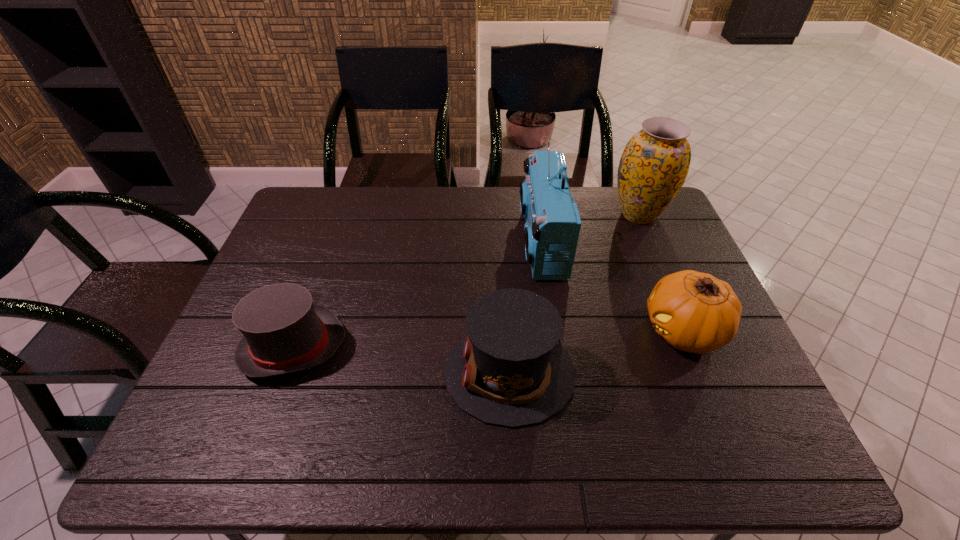
You are a GUI agent. You are given a task and a screenshot of the screen. Output one action in this format:
    pyautogui.click(x=<x>, y=<y>)
    Task: Click on the free spot located on the front face of the pumpkin
    Image resolution: width=960 pixels, height=540 pixels.
    Given the screenshot: What is the action you would take?
    pyautogui.click(x=570, y=331)

Where is `vacant point located 0.270m on the front face of the pumpkin`? The height and width of the screenshot is (540, 960). vacant point located 0.270m on the front face of the pumpkin is located at coordinates (535, 331).

Locate an element on the screen. The image size is (960, 540). vacant space situated on the front face of the pumpkin is located at coordinates (610, 331).

Image resolution: width=960 pixels, height=540 pixels. I want to click on vacant area located 0.340m with goggles on the front of the taller dress hat, so click(x=299, y=373).

Identify the location of free location located with goggles on the front of the taller dress hat. (388, 373).

Where is `free point located with goggles on the front of the taller dress hat`? The width and height of the screenshot is (960, 540). free point located with goggles on the front of the taller dress hat is located at coordinates (307, 373).

The image size is (960, 540). Find the location of `vacant space located on the right of the shortest object`. vacant space located on the right of the shortest object is located at coordinates (503, 346).

Locate an element on the screen. vase that is positioned at the far edge is located at coordinates (653, 167).

This screenshot has width=960, height=540. Identify the location of radio receiver at the far edge. (552, 228).

The height and width of the screenshot is (540, 960). Find the location of `object positioned at the near edge`. object positioned at the near edge is located at coordinates (509, 370).